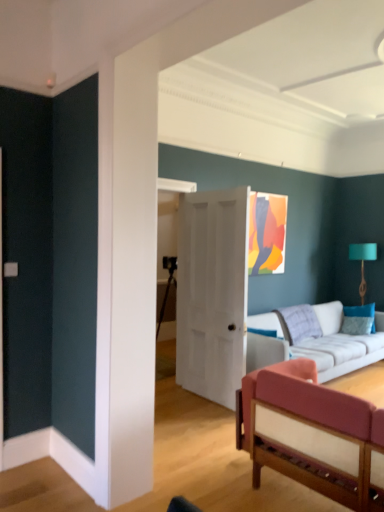
Measure the distance between teal fabric pillow at right and camera.

The depth of teal fabric pillow at right is 5.29 meters.

What do you see at coordinates (363, 261) in the screenshot?
I see `teal fabric lampshade at right` at bounding box center [363, 261].

Locate an element on the screen. The height and width of the screenshot is (512, 384). velvet pink couch at lower right, arranged as the 2th studio couch when viewed from the back is located at coordinates (309, 426).

Where is `teal fabric pillow at right`? This screenshot has height=512, width=384. teal fabric pillow at right is located at coordinates coord(359,319).

Considering the relative sizes of white fabric couch at center, which ranks as the 2th studio couch in front-to-back order, and teal fabric pillow at right in the image provided, is white fabric couch at center, which ranks as the 2th studio couch in front-to-back order, bigger than teal fabric pillow at right?

Yes, white fabric couch at center, which ranks as the 2th studio couch in front-to-back order, is bigger than teal fabric pillow at right.

Which object is wider, white fabric couch at center, acting as the first studio couch starting from the back, or teal fabric pillow at right?

white fabric couch at center, acting as the first studio couch starting from the back.

Between white fabric couch at center, acting as the first studio couch starting from the back, and teal fabric pillow at right, which one has less height?

teal fabric pillow at right is shorter.

From the image's perspective, does white fabric couch at center, acting as the first studio couch starting from the back, appear higher than teal fabric pillow at right?

No, from the image's perspective, white fabric couch at center, acting as the first studio couch starting from the back, is not over teal fabric pillow at right.

Is white matte door at center to the left or to the right of teal fabric pillow at right in the image?

Based on their positions, white matte door at center is located to the left of teal fabric pillow at right.

Which point is more distant from viewer, (197, 228) or (347, 333)?

The point (347, 333) is farther from the camera.

Measure the distance from white matte door at center to teal fabric pillow at right.

The distance of white matte door at center from teal fabric pillow at right is 7.43 feet.

Between point (278, 328) and point (180, 320), which one is positioned in front?

The point (180, 320) is closer to the camera.

Consider the image. Is white matte door at center surrounded by white fabric couch at center, which ranks as the 2th studio couch in front-to-back order?

That's incorrect, white matte door at center is not inside white fabric couch at center, which ranks as the 2th studio couch in front-to-back order.

Is point (211, 234) positioned after point (364, 294)?

No, (211, 234) is closer to viewer.

Does white matte door at center come behind teal fabric lampshade at right?

No.

Is white matte door at center to the left of teal fabric lampshade at right from the viewer's perspective?

Indeed, white matte door at center is positioned on the left side of teal fabric lampshade at right.

From the image's perspective, between white matte door at center and teal fabric lampshade at right, who is located below?

white matte door at center is shown below in the image.

From the image's perspective, between teal fabric pillow at right and white fabric couch at center, which ranks as the 2th studio couch in front-to-back order, who is located below?

From the image's view, white fabric couch at center, which ranks as the 2th studio couch in front-to-back order, is below.

Is teal fabric pillow at right looking in the opposite direction of white fabric couch at center, which ranks as the 2th studio couch in front-to-back order?

Yes, teal fabric pillow at right is positioned with its back facing white fabric couch at center, which ranks as the 2th studio couch in front-to-back order.

This screenshot has width=384, height=512. I want to click on pillow above the white fabric couch at center, acting as the first studio couch starting from the back (from the image's perspective), so click(x=359, y=319).

Is velvet pink couch at lower right, which is the 1th studio couch in front-to-back order, turned away from teal fabric pillow at right?

velvet pink couch at lower right, which is the 1th studio couch in front-to-back order, does not have its back to teal fabric pillow at right.

What's the angular difference between velvet pink couch at lower right, arranged as the 2th studio couch when viewed from the back, and teal fabric pillow at right's facing directions?

The angle between the facing direction of velvet pink couch at lower right, arranged as the 2th studio couch when viewed from the back, and the facing direction of teal fabric pillow at right is 171 degrees.

Can you confirm if velvet pink couch at lower right, which is the 1th studio couch in front-to-back order, is taller than teal fabric pillow at right?

Yes, velvet pink couch at lower right, which is the 1th studio couch in front-to-back order, is taller than teal fabric pillow at right.

In the scene shown: Can you see velvet pink couch at lower right, which is the 1th studio couch in front-to-back order, touching teal fabric pillow at right?

No, velvet pink couch at lower right, which is the 1th studio couch in front-to-back order, is not in contact with teal fabric pillow at right.

Which of these two, teal fabric pillow at right or teal fabric lampshade at right, stands taller?

With more height is teal fabric lampshade at right.

Is teal fabric pillow at right facing towards teal fabric lampshade at right?

No.

From a real-world perspective, is teal fabric pillow at right below teal fabric lampshade at right?

Correct, in the physical world, teal fabric pillow at right is lower than teal fabric lampshade at right.

From the image's perspective, count 1st studio couchs downward from the teal fabric pillow at right and point to it. Please provide its 2D coordinates.

[(322, 346)]

This screenshot has height=512, width=384. Identify the location of door above the teal fabric pillow at right (from a real-world perspective). pyautogui.click(x=212, y=293).

Estimate the real-world distances between objects in this image. Which object is further from white matte door at center, teal fabric lampshade at right or teal fabric pillow at right?

Among the two, teal fabric lampshade at right is located further to white matte door at center.

From the picture: From the image, which object appears to be farther from white matte door at center, teal fabric lampshade at right or velvet pink couch at lower right, which is the 1th studio couch in front-to-back order?

Based on the image, teal fabric lampshade at right appears to be further to white matte door at center.

From the image, which object appears to be nearer to velvet pink couch at lower right, which is the 1th studio couch in front-to-back order, teal fabric pillow at right or teal fabric lampshade at right?

Based on the image, teal fabric pillow at right appears to be nearer to velvet pink couch at lower right, which is the 1th studio couch in front-to-back order.

Based on their spatial positions, is velvet pink couch at lower right, arranged as the 2th studio couch when viewed from the back, or white fabric couch at center, acting as the first studio couch starting from the back, closer to teal fabric pillow at right?

white fabric couch at center, acting as the first studio couch starting from the back, is closer to teal fabric pillow at right.

When comparing their distances from white fabric couch at center, which ranks as the 2th studio couch in front-to-back order, does white matte door at center or teal fabric lampshade at right seem further?

The object further to white fabric couch at center, which ranks as the 2th studio couch in front-to-back order, is teal fabric lampshade at right.

Based on their spatial positions, is velvet pink couch at lower right, arranged as the 2th studio couch when viewed from the back, or white matte door at center closer to teal fabric pillow at right?

Based on the image, white matte door at center appears to be nearer to teal fabric pillow at right.

Considering their positions, is white matte door at center positioned closer to velvet pink couch at lower right, which is the 1th studio couch in front-to-back order, than teal fabric lampshade at right?

white matte door at center is closer to velvet pink couch at lower right, which is the 1th studio couch in front-to-back order.

Based on their spatial positions, is teal fabric lampshade at right or velvet pink couch at lower right, arranged as the 2th studio couch when viewed from the back, closer to teal fabric pillow at right?

Based on the image, teal fabric lampshade at right appears to be nearer to teal fabric pillow at right.

The width and height of the screenshot is (384, 512). Find the location of `pillow between velvet pink couch at lower right, arranged as the 2th studio couch when viewed from the back, and teal fabric lampshade at right from front to back`. pillow between velvet pink couch at lower right, arranged as the 2th studio couch when viewed from the back, and teal fabric lampshade at right from front to back is located at coordinates (359, 319).

Where is `door located between velvet pink couch at lower right, arranged as the 2th studio couch when viewed from the back, and teal fabric lampshade at right in the depth direction`? Image resolution: width=384 pixels, height=512 pixels. door located between velvet pink couch at lower right, arranged as the 2th studio couch when viewed from the back, and teal fabric lampshade at right in the depth direction is located at coordinates (212, 293).

In order to click on pillow between white fabric couch at center, acting as the first studio couch starting from the back, and teal fabric lampshade at right from front to back in this screenshot , I will do `click(359, 319)`.

Identify the location of door between velvet pink couch at lower right, which is the 1th studio couch in front-to-back order, and teal fabric pillow at right, along the z-axis. The width and height of the screenshot is (384, 512). (212, 293).